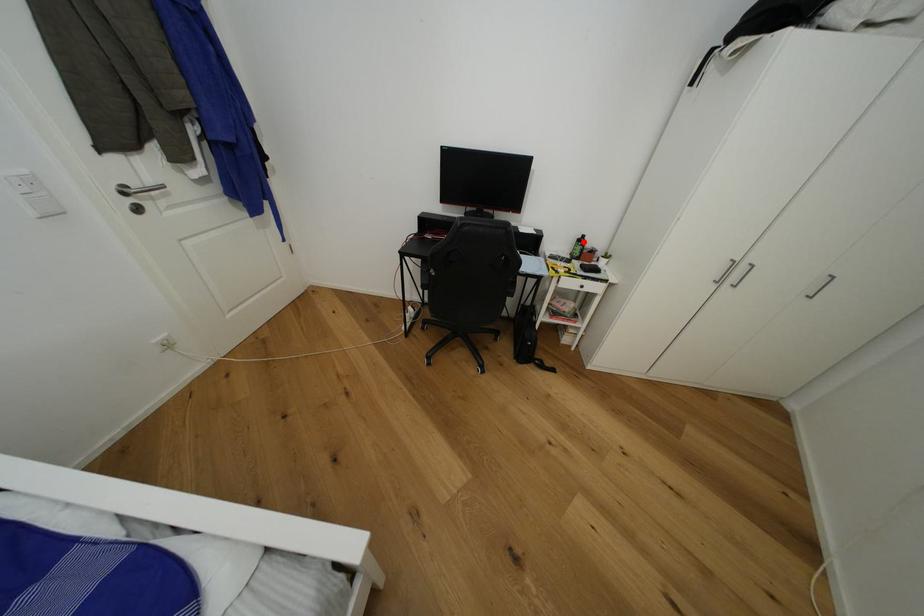
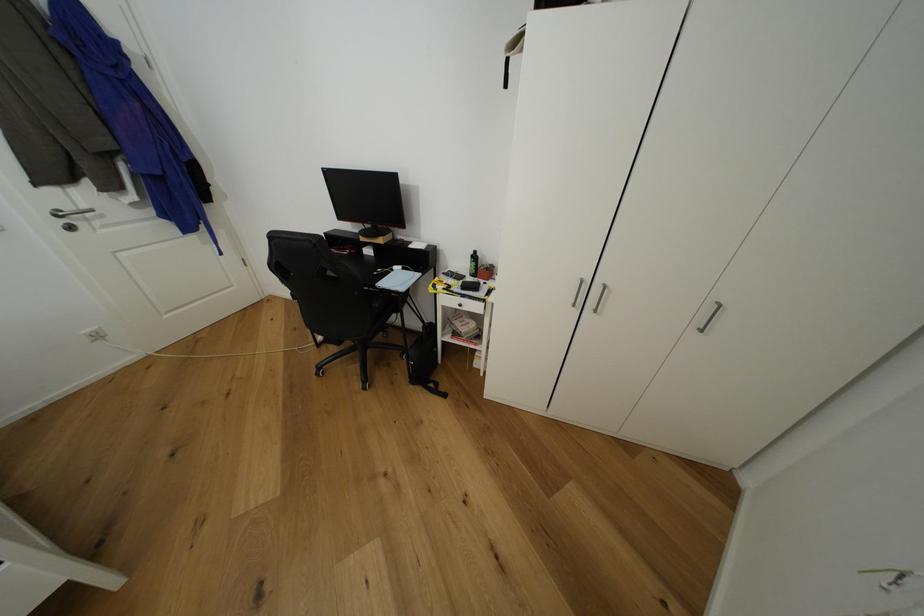
The point at the highlighted location is marked in the first image. Where is the corresponding point in the second image?

(478, 257)